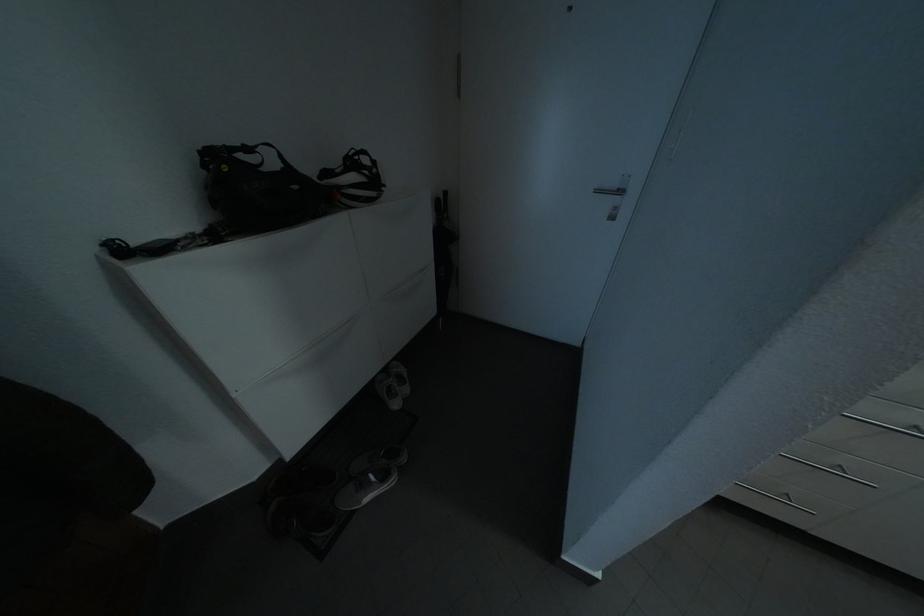
Find the location of a particular element. This screenshot has width=924, height=616. silver door handle is located at coordinates pos(610,191).